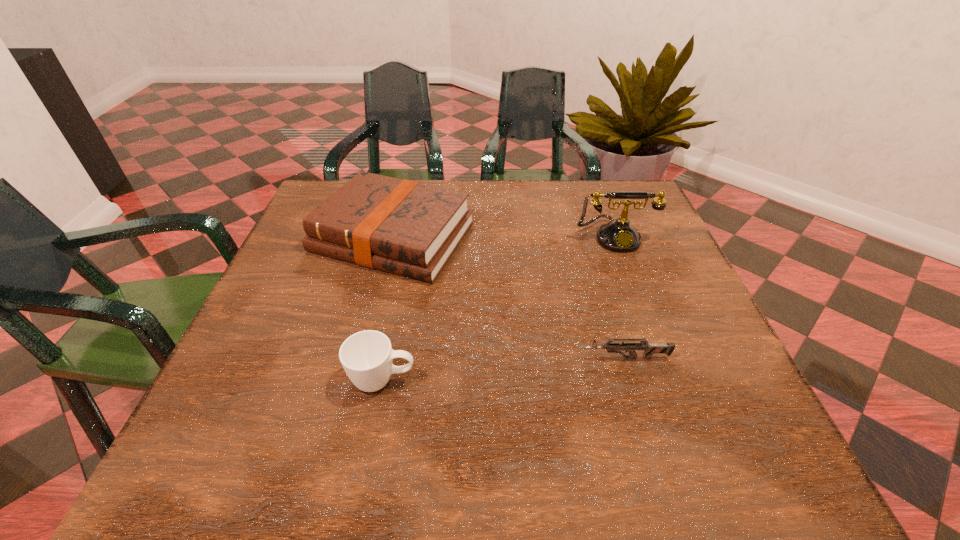
I want to click on the tallest object, so click(x=618, y=235).

You are a GUI agent. You are given a task and a screenshot of the screen. Output one action in this format:
    pyautogui.click(x=<x>, y=<y>)
    Task: Click on the hardback book
    The width and height of the screenshot is (960, 540).
    Given the screenshot: What is the action you would take?
    pyautogui.click(x=404, y=227)

At what (x,y) coordinates should I click in order to perform the action: click on cup. Please return your answer as a coordinate pair (x, y). The height and width of the screenshot is (540, 960). Looking at the image, I should click on (366, 356).

Locate an element on the screen. the second nearest object is located at coordinates (649, 349).

This screenshot has width=960, height=540. What are the coordinates of `the shortest object` in the screenshot? It's located at (649, 349).

Locate an element on the screen. vacant space located on the dial of the telephone is located at coordinates (638, 300).

This screenshot has width=960, height=540. Identify the location of vacant space situated 0.340m on the right of the hardback book. (609, 237).

Where is `vacant space situated with the handle on the side of the cup`? vacant space situated with the handle on the side of the cup is located at coordinates (584, 380).

Locate an element on the screen. blank space located aimed along the barrel of the second nearest object is located at coordinates (482, 358).

What are the coordinates of `free location located aimed along the barrel of the second nearest object` in the screenshot? It's located at (444, 358).